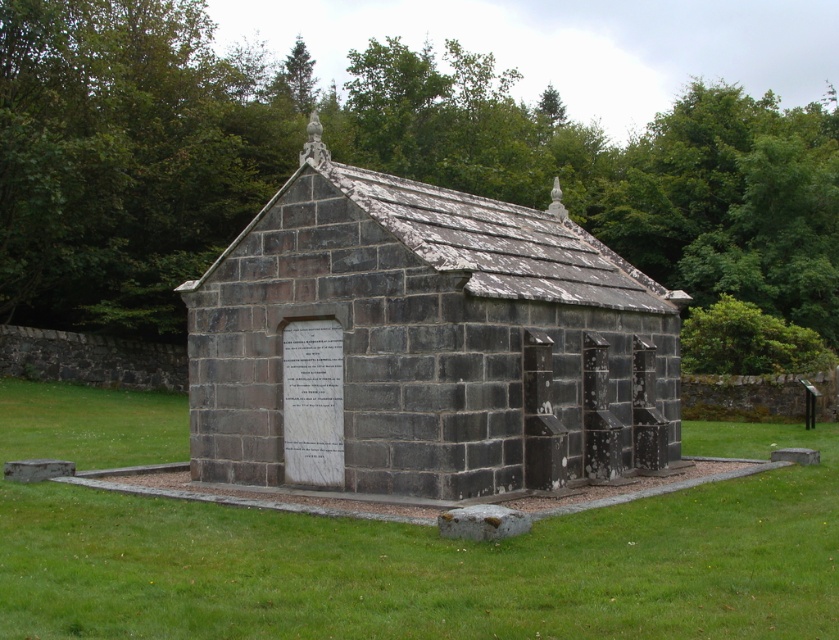
Question: Considering the real-world distances, which object is farthest from the green leafy tree at center?

Choices:
 (A) dark gray stone church at center
 (B) green grass at lower center

Answer: (B)

Question: Is dark gray stone church at center wider than green grass at lower center?

Choices:
 (A) yes
 (B) no

Answer: (B)

Question: Is green leafy tree at center positioned at the back of green grass at lower center?

Choices:
 (A) no
 (B) yes

Answer: (B)

Question: Among these objects, which one is nearest to the camera?

Choices:
 (A) green grass at lower center
 (B) dark gray stone church at center

Answer: (A)

Question: Is green leafy tree at center below green grass at lower center?

Choices:
 (A) no
 (B) yes

Answer: (A)

Question: Which of the following is the farthest from the observer?

Choices:
 (A) green leafy tree at center
 (B) green grass at lower center
 (C) dark gray stone church at center

Answer: (A)